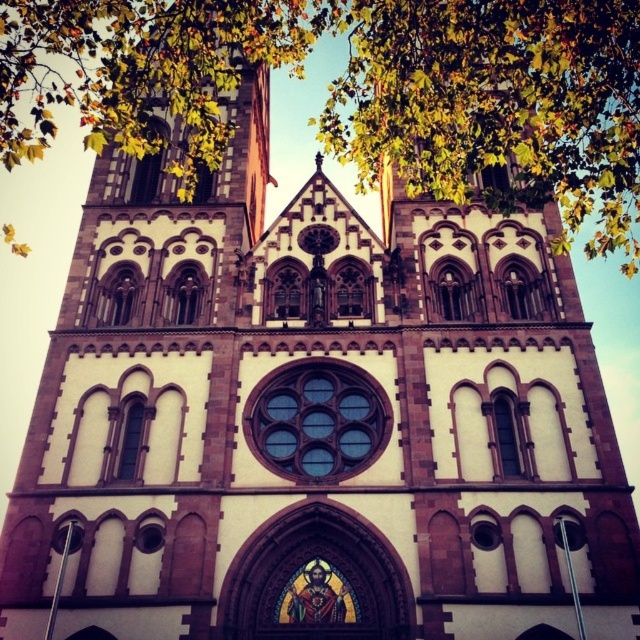
Question: Does green leafy tree at upper center have a lesser width compared to clear glass window at center?

Choices:
 (A) no
 (B) yes

Answer: (A)

Question: Which of the following is the farthest from the observer?

Choices:
 (A) green leafy tree at upper center
 (B) clear glass window at center

Answer: (B)

Question: Is green leafy tree at upper center closer to the viewer compared to clear glass window at center?

Choices:
 (A) yes
 (B) no

Answer: (A)

Question: Can you confirm if green leafy tree at upper center is positioned to the left of clear glass window at center?

Choices:
 (A) no
 (B) yes

Answer: (A)

Question: Which of the following is the closest to the observer?

Choices:
 (A) (365, 422)
 (B) (634, 17)

Answer: (B)